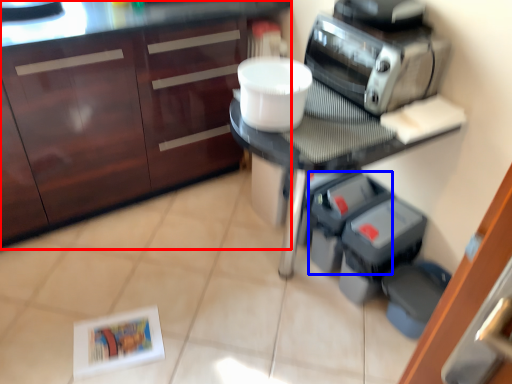
Question: Which object appears farthest to the camera in this image, cabinetry (highlighted by a red box) or appliance (highlighted by a blue box)?

Choices:
 (A) cabinetry
 (B) appliance

Answer: (B)